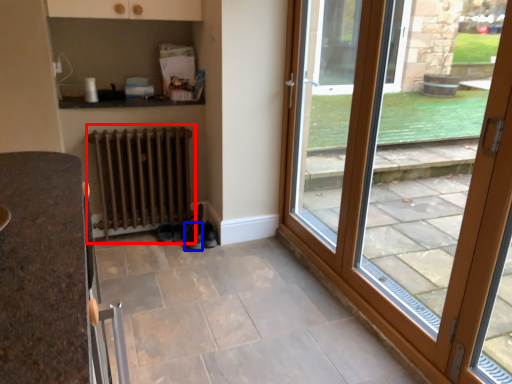
Question: Which of the following is the farthest to the observer, radiator (highlighted by a red box) or shoe (highlighted by a blue box)?

Choices:
 (A) radiator
 (B) shoe

Answer: (B)